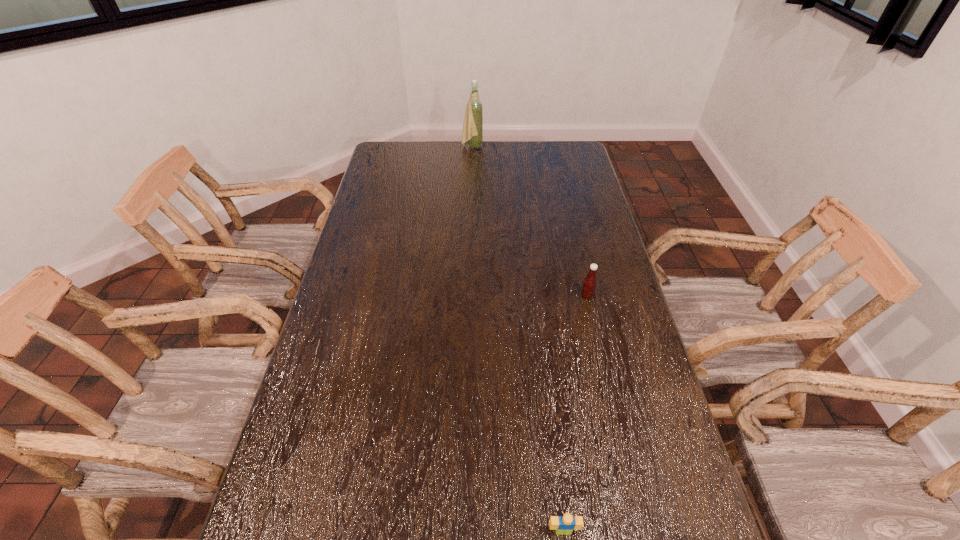
I want to click on free location that satisfies the following two spatial constraints: 1. on the front-facing side of the wine bottle; 2. on the right side of the Tabasco sauce, so click(x=468, y=296).

The image size is (960, 540). I want to click on free point that satisfies the following two spatial constraints: 1. on the front-facing side of the rightmost object; 2. on the right side of the wine bottle, so click(x=468, y=296).